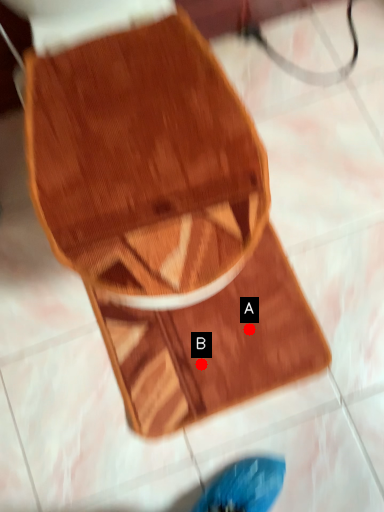
Question: Two points are circled on the image, labeled by A and B beside each circle. Among these points, which one is nearest to the camera?

Choices:
 (A) A is closer
 (B) B is closer

Answer: (B)